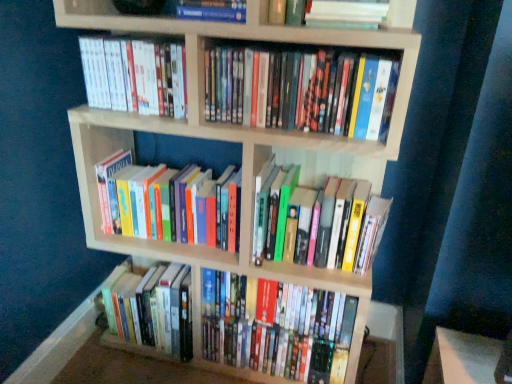
Question: Considering the relative positions of hardcover book at upper center, placed as the first book when sorted from top to bottom, and white matte book at upper center, the second book in the top-to-bottom sequence, in the image provided, is hardcover book at upper center, placed as the first book when sorted from top to bottom, to the left of white matte book at upper center, the second book in the top-to-bottom sequence, from the viewer's perspective?

Choices:
 (A) yes
 (B) no

Answer: (A)

Question: Does hardcover book at upper center, the eighth book from the bottom, have a smaller size compared to white matte book at upper center, the 7th book from the bottom?

Choices:
 (A) no
 (B) yes

Answer: (A)

Question: Does hardcover book at upper center, the eighth book from the bottom, appear on the right side of white matte book at upper center, the second book in the top-to-bottom sequence?

Choices:
 (A) yes
 (B) no

Answer: (B)

Question: From the image's perspective, does hardcover book at upper center, the eighth book from the bottom, appear lower than white matte book at upper center, the 7th book from the bottom?

Choices:
 (A) no
 (B) yes

Answer: (A)

Question: Is hardcover book at upper center, the eighth book from the bottom, shorter than white matte book at upper center, the second book in the top-to-bottom sequence?

Choices:
 (A) no
 (B) yes

Answer: (A)

Question: Visually, is hardcover book at upper center, the eighth book from the bottom, positioned to the left or to the right of hardcover books at lower left, which is the second book from bottom to top?

Choices:
 (A) left
 (B) right

Answer: (B)

Question: Looking at their shapes, would you say hardcover book at upper center, placed as the first book when sorted from top to bottom, is wider or thinner than hardcover books at lower left, which is the second book from bottom to top?

Choices:
 (A) thin
 (B) wide

Answer: (A)

Question: In the image, is hardcover book at upper center, the eighth book from the bottom, positioned in front of or behind hardcover books at lower left, which is the second book from bottom to top?

Choices:
 (A) front
 (B) behind

Answer: (A)

Question: From the image's perspective, is hardcover book at upper center, the eighth book from the bottom, located above or below hardcover books at lower left, which ranks as the seventh book in top-to-bottom order?

Choices:
 (A) below
 (B) above

Answer: (B)

Question: Is multicolored hardcover books at upper center, which appears as the 5th book when ordered from the bottom, taller or shorter than white matte book at upper center, the 7th book from the bottom?

Choices:
 (A) short
 (B) tall

Answer: (B)

Question: In terms of width, does multicolored hardcover books at upper center, which appears as the 5th book when ordered from the bottom, look wider or thinner when compared to white matte book at upper center, the 7th book from the bottom?

Choices:
 (A) thin
 (B) wide

Answer: (A)

Question: Is point (331, 52) closer or farther from the camera than point (375, 6)?

Choices:
 (A) closer
 (B) farther

Answer: (A)

Question: Is multicolored hardcover books at upper center, which appears as the 5th book when ordered from the bottom, to the left or to the right of white matte book at upper center, the second book in the top-to-bottom sequence, in the image?

Choices:
 (A) left
 (B) right

Answer: (A)

Question: Considering their positions, is white matte book at upper center, the 7th book from the bottom, located in front of or behind hardcover book at center, the eighth book from the top?

Choices:
 (A) behind
 (B) front

Answer: (B)

Question: From a real-world perspective, is white matte book at upper center, the 7th book from the bottom, physically located above or below hardcover book at center, which ranks as the first book in bottom-to-top order?

Choices:
 (A) below
 (B) above

Answer: (B)